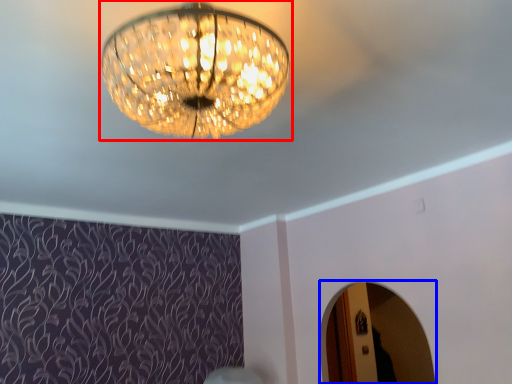
Question: Which of the following is the farthest to the observer, lamp (highlighted by a red box) or mirror (highlighted by a blue box)?

Choices:
 (A) lamp
 (B) mirror

Answer: (B)